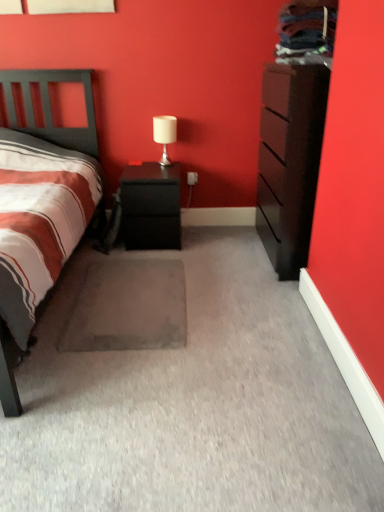
Question: Considering the relative sizes of black matte nightstand at center and white matte table lamp at upper center in the image provided, is black matte nightstand at center bigger than white matte table lamp at upper center?

Choices:
 (A) yes
 (B) no

Answer: (A)

Question: From the image's perspective, would you say black matte nightstand at center is shown under white matte table lamp at upper center?

Choices:
 (A) no
 (B) yes

Answer: (B)

Question: Is black matte nightstand at center turned away from white matte table lamp at upper center?

Choices:
 (A) no
 (B) yes

Answer: (A)

Question: Does black matte nightstand at center contain white matte table lamp at upper center?

Choices:
 (A) yes
 (B) no

Answer: (B)

Question: Is black matte nightstand at center shorter than white matte table lamp at upper center?

Choices:
 (A) no
 (B) yes

Answer: (A)

Question: Considering the positions of white matte table lamp at upper center and black matte nightstand at center in the image, is white matte table lamp at upper center wider or thinner than black matte nightstand at center?

Choices:
 (A) thin
 (B) wide

Answer: (A)

Question: Is white matte table lamp at upper center in front of or behind black matte nightstand at center in the image?

Choices:
 (A) front
 (B) behind

Answer: (B)

Question: From their relative heights in the image, would you say white matte table lamp at upper center is taller or shorter than black matte nightstand at center?

Choices:
 (A) tall
 (B) short

Answer: (B)

Question: Considering the positions of point (160, 134) and point (137, 243), is point (160, 134) closer or farther from the camera than point (137, 243)?

Choices:
 (A) farther
 (B) closer

Answer: (A)

Question: Visually, is dark brown wood chest of drawers at right positioned to the left or to the right of black matte nightstand at center?

Choices:
 (A) left
 (B) right

Answer: (B)

Question: Is dark brown wood chest of drawers at right inside or outside of black matte nightstand at center?

Choices:
 (A) outside
 (B) inside

Answer: (A)

Question: In terms of height, does dark brown wood chest of drawers at right look taller or shorter compared to black matte nightstand at center?

Choices:
 (A) tall
 (B) short

Answer: (A)

Question: From the image's perspective, is dark brown wood chest of drawers at right above or below black matte nightstand at center?

Choices:
 (A) below
 (B) above

Answer: (B)

Question: Does point (148, 293) appear closer or farther from the camera than point (168, 237)?

Choices:
 (A) closer
 (B) farther

Answer: (A)

Question: Considering the positions of gray carpet at center and black matte nightstand at center in the image, is gray carpet at center wider or thinner than black matte nightstand at center?

Choices:
 (A) thin
 (B) wide

Answer: (B)